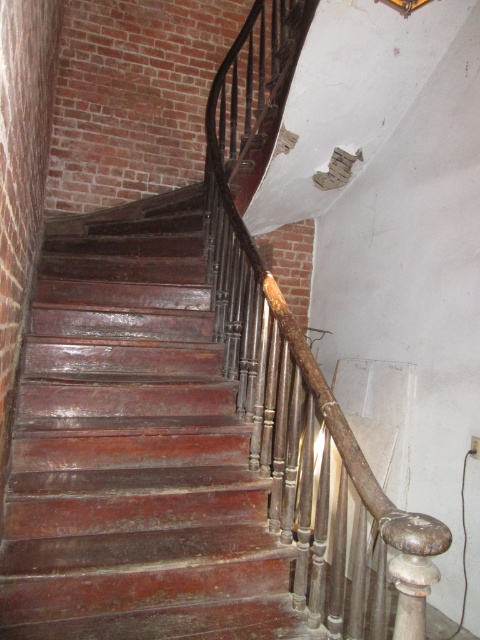
Question: Does shiny wood stairs at center have a smaller size compared to rusty metal railing at center?

Choices:
 (A) yes
 (B) no

Answer: (B)

Question: Can you confirm if shiny wood stairs at center is smaller than rusty metal railing at center?

Choices:
 (A) yes
 (B) no

Answer: (B)

Question: Which of the following is the farthest from the observer?

Choices:
 (A) shiny wood stairs at center
 (B) rusty metal railing at center

Answer: (A)

Question: Is shiny wood stairs at center wider than rusty metal railing at center?

Choices:
 (A) yes
 (B) no

Answer: (A)

Question: Which object appears closest to the camera in this image?

Choices:
 (A) shiny wood stairs at center
 (B) rusty metal railing at center

Answer: (B)